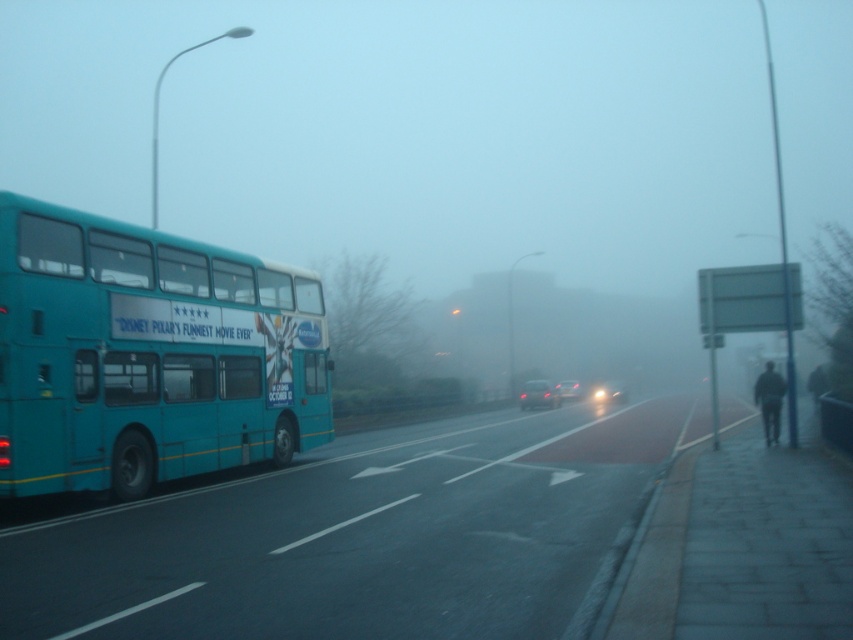
You are standing at the center of the image. Which object is located at the coordinates point (148, 355)?

The teal matte double decker bus at left is located at point (148, 355).